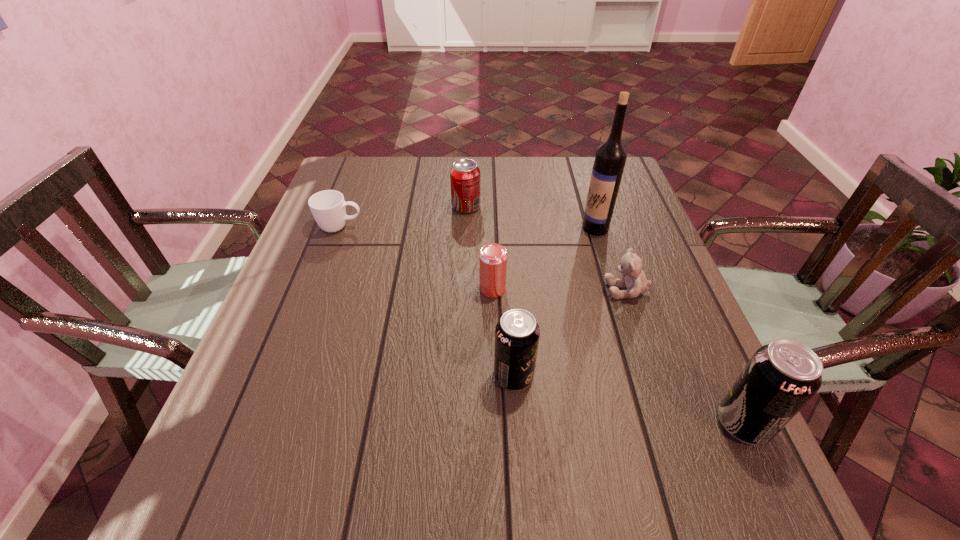
In the current image, all soda cans are evenly spaced. To maintain this equal spacing, where should an additional soda can be placed on the left? Please point out a free spot. Please provide its 2D coordinates. Your answer should be formatted as a tuple, i.e. [(x, y)], where the tuple contains the x and y coordinates of a point satisfying the conditions above.

[(319, 336)]